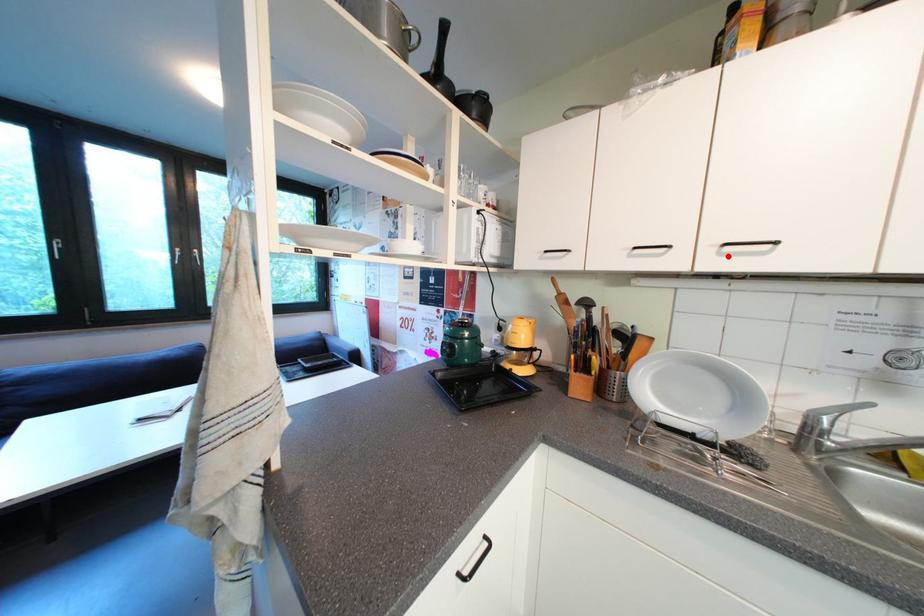
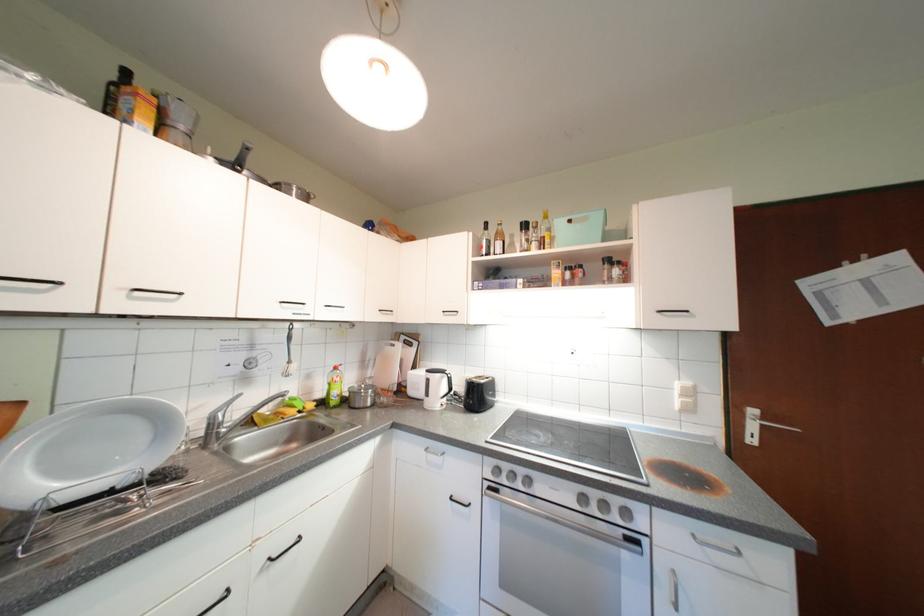
In the second image, find the point that corresponds to the highlighted location in the first image.

(139, 300)